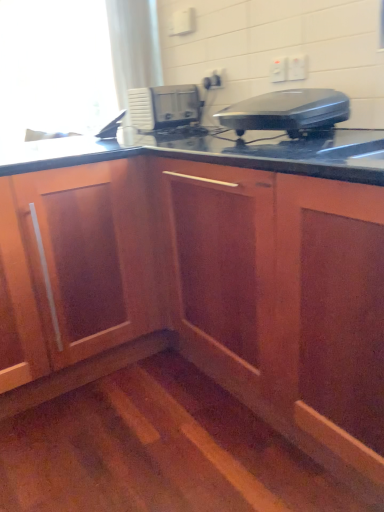
Question: In terms of size, does transparent glass window screen at upper left appear bigger or smaller than white plastic electric outlet at upper center, which is counted as the second electric outlet, starting from the right?

Choices:
 (A) small
 (B) big

Answer: (B)

Question: Considering the positions of point (0, 13) and point (278, 67), is point (0, 13) closer or farther from the camera than point (278, 67)?

Choices:
 (A) closer
 (B) farther

Answer: (B)

Question: Which object is positioned farthest from the transparent glass window screen at upper left?

Choices:
 (A) white plastic electric outlet at upper center, positioned as the third electric outlet in front-to-back order
 (B) black plastic toaster at upper right, which appears as the 2th home appliance when viewed from the left
 (C) wooden cabinet at center
 (D) white plastic electric outlet at upper center, which is the 2th electric outlet in front-to-back order
 (E) white plastic microwave at center, which ranks as the 2th home appliance in front-to-back order

Answer: (D)

Question: Which is nearer to the white plastic electric outlet at upper center, which is counted as the second electric outlet, starting from the right?

Choices:
 (A) black plastic toaster at upper right, which appears as the 2th home appliance when viewed from the top
 (B) white plastic electric outlet at upper right, the 3th electric outlet from the left
 (C) white plastic microwave at center, which is counted as the second home appliance, starting from the bottom
 (D) white plastic electric outlet at upper center, placed as the 3th electric outlet when sorted from right to left
 (E) transparent glass window screen at upper left

Answer: (B)